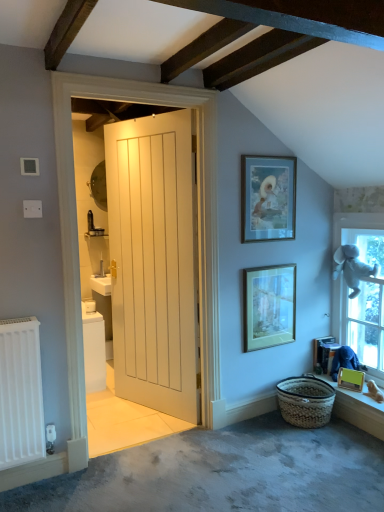
You are a GUI agent. You are given a task and a screenshot of the screen. Output one action in this format:
    pyautogui.click(x=<x>, y=<y>)
    Task: Click on the vacant area that is in front of braided straw basket at lower right
    The height and width of the screenshot is (512, 384).
    Given the screenshot: What is the action you would take?
    pyautogui.click(x=318, y=447)